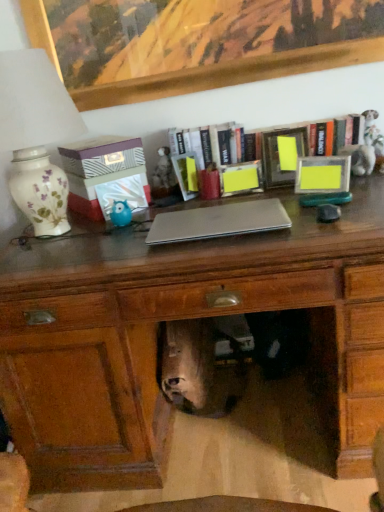
Find the location of a particular element. The height and width of the screenshot is (512, 384). vacant area that lies in front of matte yellow picture frame at right, which is the first picture frame in right-to-left order is located at coordinates (345, 203).